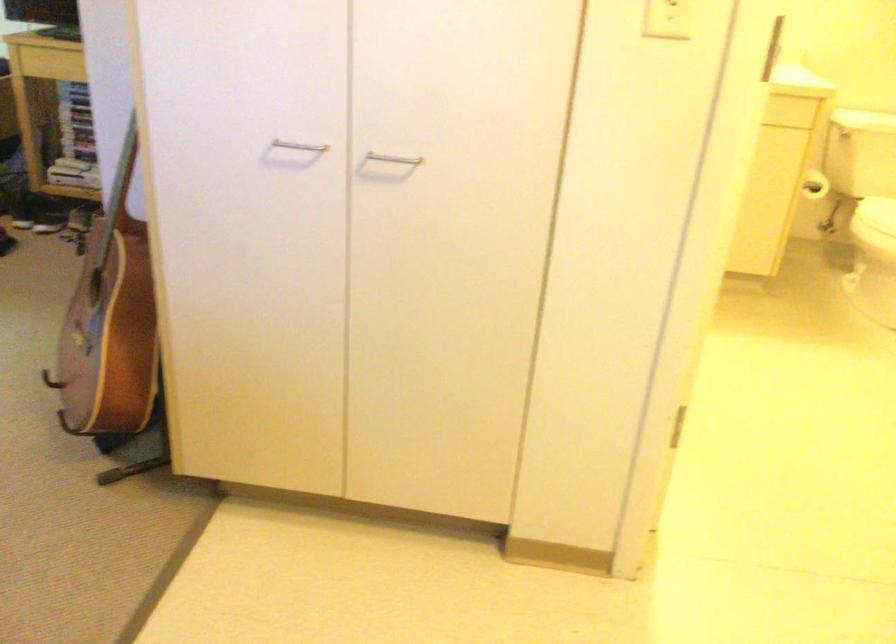
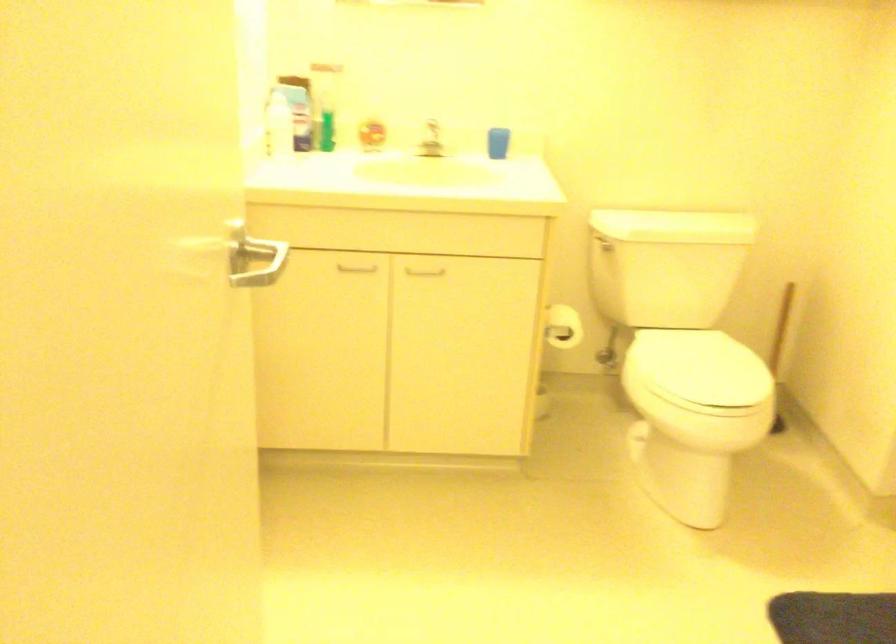
In a continuous first-person perspective shot, in which direction is the camera moving?

The cameraman moved toward right, forward.